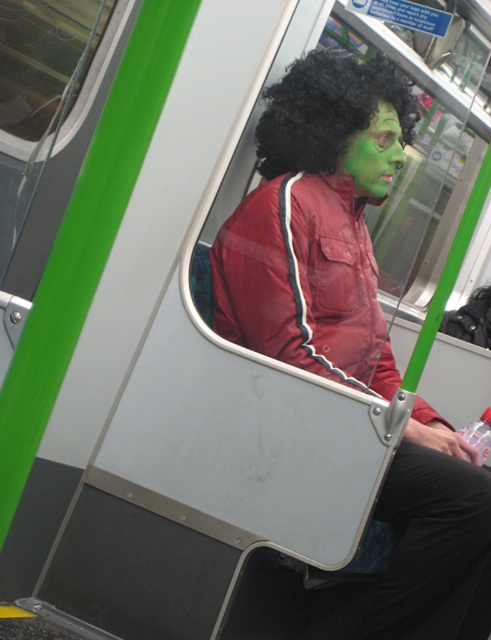
You are standing in the subway car and want to take a photo of the black curly wig at upper center. If your camera has a minimum focusing distance of 2 meters, will you be able to take a clear photo from your current position?

The black curly wig at upper center and viewer are 1.94 meters apart, which is less than the camera minimum focusing distance of 2 meters. Therefore, you cannot take a clear photo from your current position.

You are standing 1.5 meters away from the point at coordinates point (272, 166). If you want to move closer to it, how much distance do you need to cover?

The point (272, 166) is currently 2.06 meters away from the viewer. If you are standing 1.5 meters away from it, you need to move 0.56 meters closer to reach the point.

From the picture: You are a photographer planning to take a portrait of the person in the train car. The black curly wig at upper center is an important element. Where should you position your camera to ensure the wig is centered in the frame?

To center the black curly wig at upper center in the frame, position the camera so that the center of the frame aligns with the coordinates point (327, 109) where the wig is located.